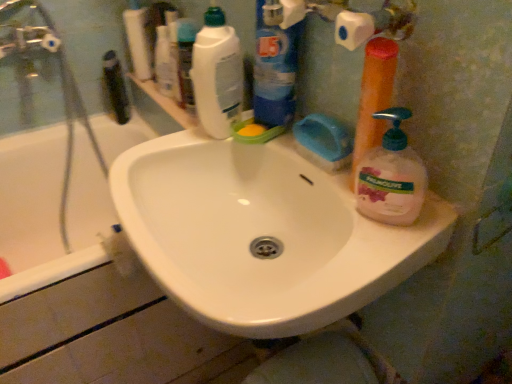
Question: Can you confirm if black plastic toothbrush at left, which ranks as the 2th toiletry in front-to-back order, is positioned to the right of white glossy bathtub at left?

Choices:
 (A) yes
 (B) no

Answer: (A)

Question: Does black plastic toothbrush at left, the 1th toiletry when ordered from back to front, turn towards white glossy bathtub at left?

Choices:
 (A) no
 (B) yes

Answer: (B)

Question: From a real-world perspective, does black plastic toothbrush at left, placed as the 2th toiletry when sorted from right to left, sit lower than white glossy bathtub at left?

Choices:
 (A) no
 (B) yes

Answer: (A)

Question: Would you consider black plastic toothbrush at left, which ranks as the 2th toiletry in front-to-back order, to be distant from white glossy bathtub at left?

Choices:
 (A) yes
 (B) no

Answer: (B)

Question: Does black plastic toothbrush at left, placed as the 2th toiletry when sorted from right to left, come behind white glossy bathtub at left?

Choices:
 (A) no
 (B) yes

Answer: (B)

Question: Is black plastic toothbrush at left, the 1th toiletry from the left, surrounding white glossy bathtub at left?

Choices:
 (A) yes
 (B) no

Answer: (B)

Question: From a real-world perspective, is white glossy bathtub at left positioned over black plastic toothbrush at left, the 1th toiletry when ordered from back to front, based on gravity?

Choices:
 (A) yes
 (B) no

Answer: (B)

Question: Is white glossy bathtub at left thinner than black plastic toothbrush at left, the 1th toiletry from the left?

Choices:
 (A) no
 (B) yes

Answer: (A)

Question: Are white glossy bathtub at left and black plastic toothbrush at left, the 1th toiletry from the left, far apart?

Choices:
 (A) yes
 (B) no

Answer: (B)

Question: From the image's perspective, is white glossy bathtub at left located above black plastic toothbrush at left, the 1th toiletry from the left?

Choices:
 (A) yes
 (B) no

Answer: (B)

Question: Is white glossy bathtub at left facing towards black plastic toothbrush at left, placed as the 2th toiletry when sorted from right to left?

Choices:
 (A) no
 (B) yes

Answer: (A)

Question: Can you confirm if white glossy bathtub at left is shorter than black plastic toothbrush at left, the 1th toiletry from the left?

Choices:
 (A) no
 (B) yes

Answer: (A)

Question: Is orange plastic pump bottle at right, the third cleaning product viewed from the left, next to blue plastic bottle at upper center, the 2th cleaning product when ordered from left to right, and touching it?

Choices:
 (A) yes
 (B) no

Answer: (B)